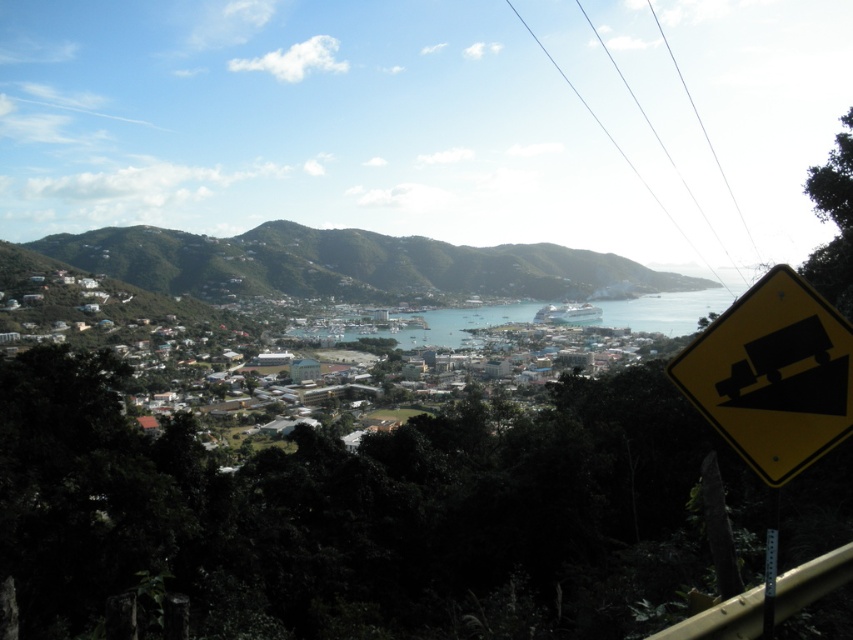
You are a hiker standing at the viewpoint overlooking the coastal town. You notice the green grassy hillside at upper left and the blue water at center. Which of these two landmarks is closer to your current position?

The green grassy hillside at upper left is closer to your current position because the blue water at center is behind it.

You are standing at the viewpoint looking at the coastal town. A drone is flying towards the point marked at coordinates point [706,417]. If the drone is currently 15 meters away from you, will it reach the point before it gets closer than 10 meters to you?

The distance of point [706,417] from camera is 12.44 meters. Since the drone is currently 15 meters away and moving towards the point, it will pass the point at 12.44 meters and continue closer to you. Therefore, the drone will reach the point before getting closer than 10 meters to you.